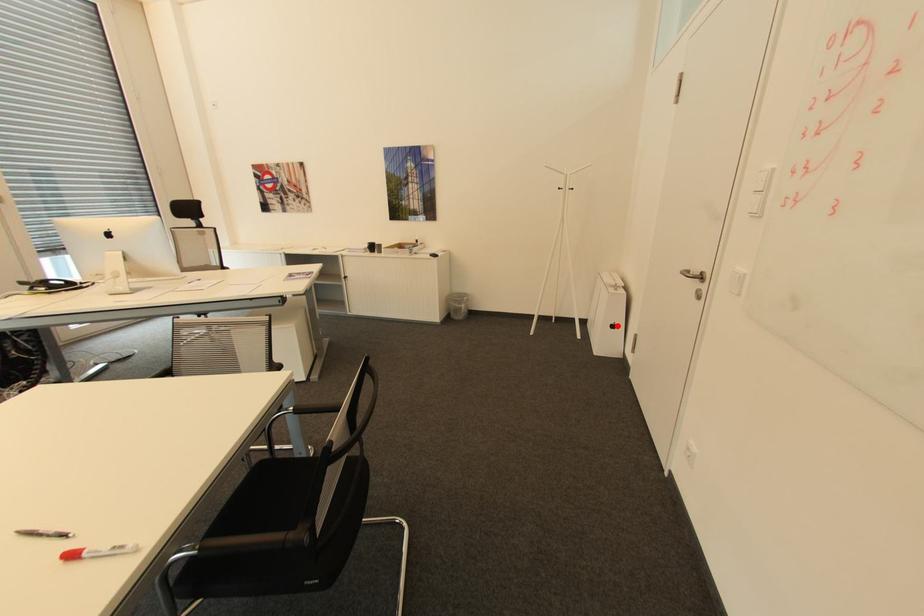
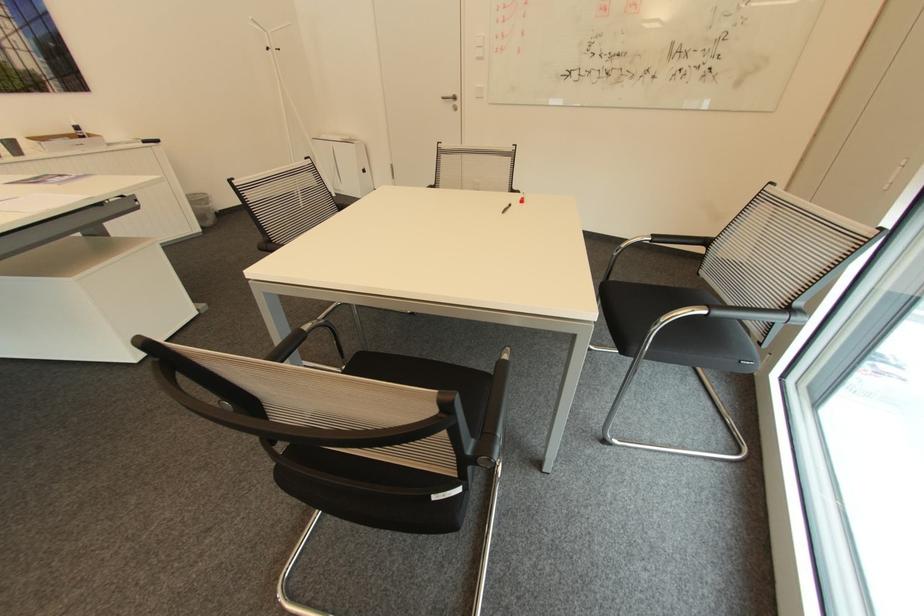
Find the pixel in the second image that matches the highlighted location in the first image.

(369, 171)